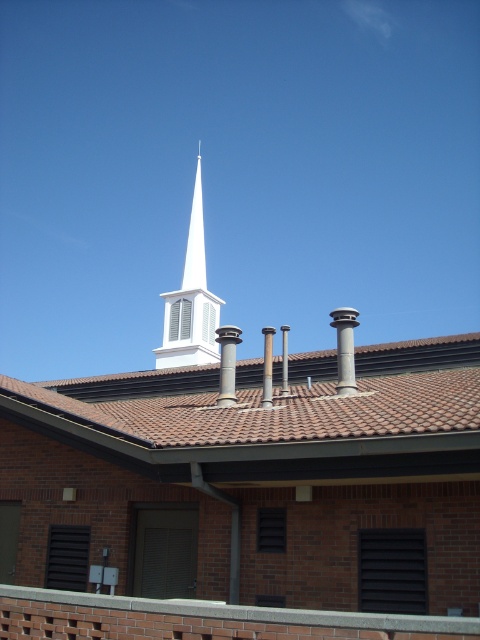
Question: Can you confirm if slate gray chimney at upper center is wider than slate gray stone chimney at center?

Choices:
 (A) no
 (B) yes

Answer: (B)

Question: Among these objects, which one is farthest from the camera?

Choices:
 (A) slate gray stone chimney at center
 (B) white smooth steeple at upper center

Answer: (B)

Question: Is white smooth steeple at upper center to the left of slate gray stone chimney at center from the viewer's perspective?

Choices:
 (A) yes
 (B) no

Answer: (A)

Question: Which object is the closest to the slate gray stone chimney at center?

Choices:
 (A) white smooth steeple at upper center
 (B) slate gray chimney at upper center

Answer: (B)

Question: Can you confirm if slate gray chimney at upper center is positioned below slate gray stone chimney at center?

Choices:
 (A) no
 (B) yes

Answer: (A)

Question: Among these objects, which one is farthest from the camera?

Choices:
 (A) white smooth steeple at upper center
 (B) slate gray chimney at upper center
 (C) slate gray stone chimney at center

Answer: (A)